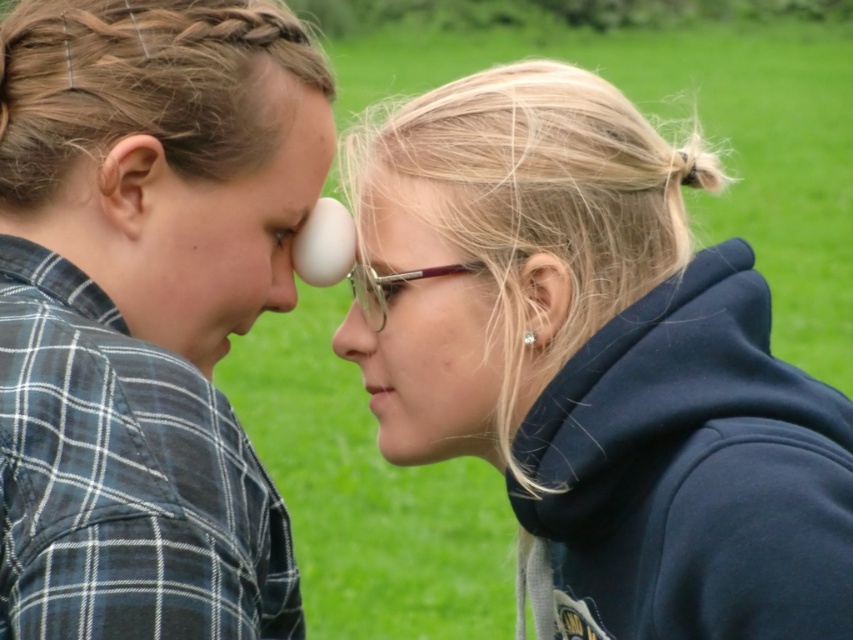
Does translucent plastic forehead at center appear on the right side of matte white nose at center?

Indeed, translucent plastic forehead at center is positioned on the right side of matte white nose at center.

Does translucent plastic forehead at center appear on the left side of matte white nose at center?

In fact, translucent plastic forehead at center is to the right of matte white nose at center.

Image resolution: width=853 pixels, height=640 pixels. I want to click on translucent plastic forehead at center, so click(x=405, y=225).

At what (x,y) coordinates should I click in order to perform the action: click on translucent plastic forehead at center. Please return your answer as a coordinate pair (x, y). This screenshot has height=640, width=853. Looking at the image, I should click on (405, 225).

Which is above, matte black shirt at left or matte white nose at center?

Positioned higher is matte white nose at center.

Can you confirm if matte black shirt at left is taller than matte white nose at center?

Yes.

Is point (16, 33) in front of point (287, 294)?

Yes, it is.

Identify the location of matte black shirt at left. (141, 317).

Is pearl earring at upper right above smooth white nose at center?

Yes.

Can you confirm if pearl earring at upper right is taller than smooth white nose at center?

In fact, pearl earring at upper right may be shorter than smooth white nose at center.

Is point (544, 317) positioned behind point (350, 337)?

That is False.

At what (x,y) coordinates should I click in order to perform the action: click on pearl earring at upper right. Please return your answer as a coordinate pair (x, y). The image size is (853, 640). Looking at the image, I should click on (543, 298).